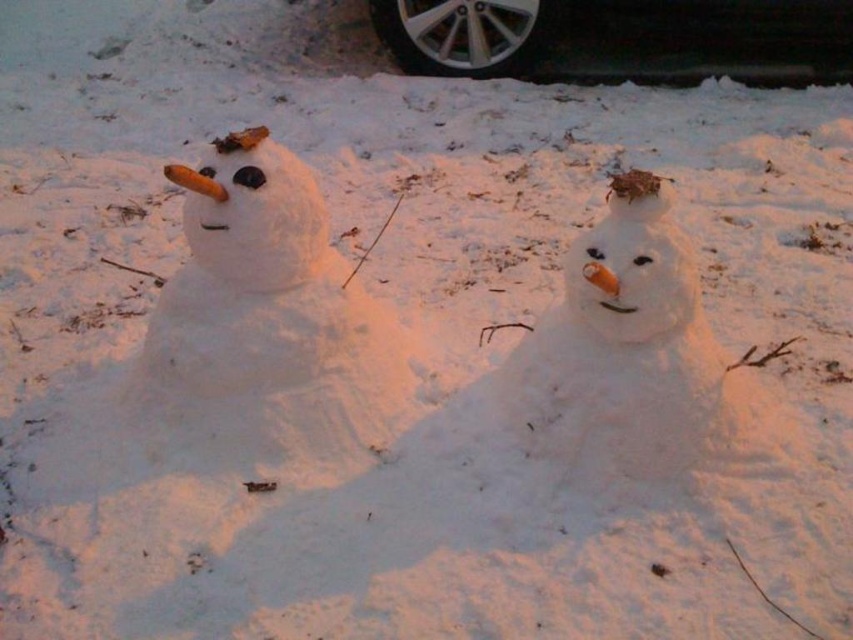
You are a child who wants to touch both the white fluffy snowman at left and the black rubber tire at upper center. Which object can you reach first without moving your position?

The white fluffy snowman at left is closer to the viewer than the black rubber tire at upper center, so you can reach the white fluffy snowman at left first without moving your position.